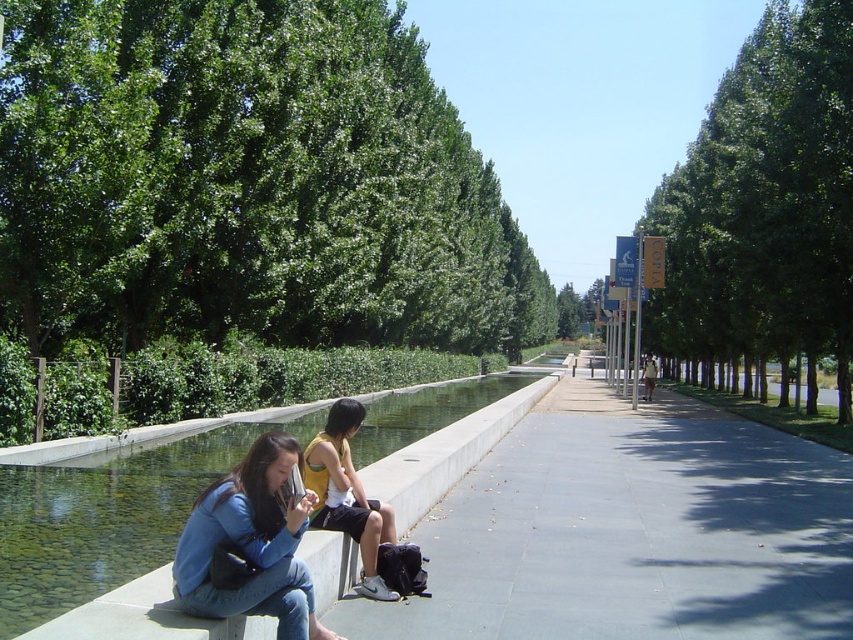
Does green leafy tree at right appear on the right side of blue denim jeans at lower left?

Correct, you'll find green leafy tree at right to the right of blue denim jeans at lower left.

Is green leafy tree at right taller than blue denim jeans at lower left?

Yes.

In order to click on green leafy tree at right in this screenshot , I will do `click(766, 202)`.

You are a GUI agent. You are given a task and a screenshot of the screen. Output one action in this format:
    pyautogui.click(x=<x>, y=<y>)
    Task: Click on the green leafy trees at center
    This screenshot has height=640, width=853.
    Given the screenshot: What is the action you would take?
    pyautogui.click(x=247, y=180)

Is point (248, 104) positioned before point (374, 538)?

No, (248, 104) is further to viewer.

Is point (369, 44) behind point (310, 452)?

Yes, point (369, 44) is behind point (310, 452).

Where is `green leafy trees at center`? This screenshot has height=640, width=853. green leafy trees at center is located at coordinates tap(247, 180).

Is green concrete waterway at lower left wider than yellow jersey at center?

Correct, the width of green concrete waterway at lower left exceeds that of yellow jersey at center.

Measure the distance between point (62, 621) and camera.

Point (62, 621) is 11.33 feet from camera.

Who is more forward, (339, 566) or (360, 417)?

Point (339, 566)

Locate an element on the screen. The image size is (853, 640). green concrete waterway at lower left is located at coordinates (447, 452).